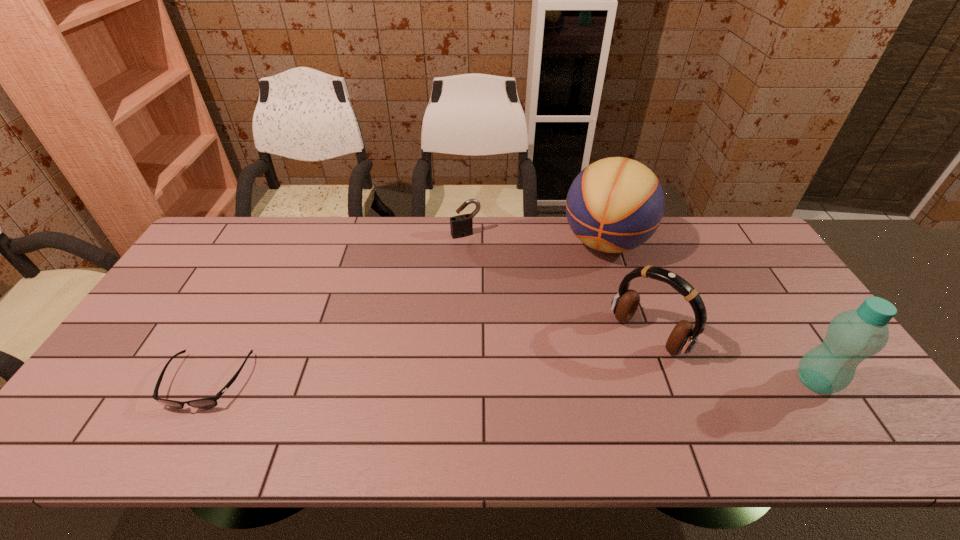
Identify the location of free space at the far right corner of the desktop. This screenshot has height=540, width=960. (730, 226).

What are the coordinates of `free space between the leftmost object and the second shortest object` in the screenshot? It's located at (336, 308).

Locate an element on the screen. blank region between the shortest object and the basketball is located at coordinates (406, 312).

Locate an element on the screen. empty space between the rightmost object and the third tallest object is located at coordinates (732, 358).

This screenshot has width=960, height=540. I want to click on blank region between the rightmost object and the fourth tallest object, so click(640, 308).

You are a GUI agent. You are given a task and a screenshot of the screen. Output one action in this format:
    pyautogui.click(x=<x>, y=<y>)
    Task: Click on the vacant space in between the leftmost object and the second object from left to right
    The height and width of the screenshot is (540, 960).
    Given the screenshot: What is the action you would take?
    pyautogui.click(x=336, y=308)

Identify the location of empty space that is in between the headset and the rightmost object. (732, 358).

You are a GUI agent. You are given a task and a screenshot of the screen. Output one action in this format:
    pyautogui.click(x=<x>, y=<y>)
    Task: Click on the unoccupied area between the sunglasses and the bottle
    
    Given the screenshot: What is the action you would take?
    pyautogui.click(x=511, y=381)

You are a GUI agent. You are given a task and a screenshot of the screen. Output one action in this format:
    pyautogui.click(x=<x>, y=<y>)
    Task: Click on the vacant area that lies between the bottle and the headset
    The image size is (960, 540).
    Given the screenshot: What is the action you would take?
    pyautogui.click(x=732, y=358)

Where is `object that is the second nearest to the padlock`? This screenshot has width=960, height=540. object that is the second nearest to the padlock is located at coordinates (683, 338).